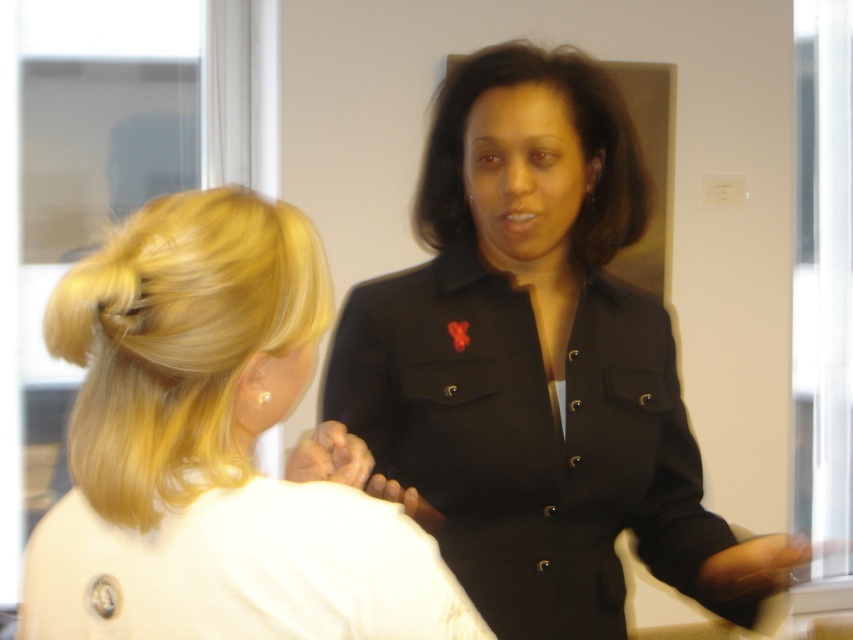
You are standing in the scene and want to reach a point that is exactly 30 inches away from you. Is the point at coordinates point (242, 536) within your reach?

The distance of point (242, 536) from viewer is 29.98 inches, so yes, the point at coordinates point (242, 536) is within reach since it is just slightly less than 30 inches away.

You are an interior designer observing the scene. You need to place a decorative shelf between the matte black blazer at upper right and the blonde silky hair at left. Based on their positions, where should the shelf be placed?

The shelf should be placed below the blonde silky hair at left because the matte black blazer at upper right is positioned under it, meaning the hair is above the blazer. Therefore, placing the shelf below the hair ensures it is between the two objects.

You are a photographer standing in front of the scene. You want to take a photo of the matte black blazer at upper right and the blonde silky hair at left. The minimum distance between the two objects in the photo should be at least 1.5 inches to ensure clarity. Based on the current arrangement, will the photo meet this requirement?

The matte black blazer at upper right and the blonde silky hair at left are 1.46 inches apart from each other, which is less than the required 1.5 inches. Therefore, the photo may not meet the clarity requirement due to the objects being too close together.